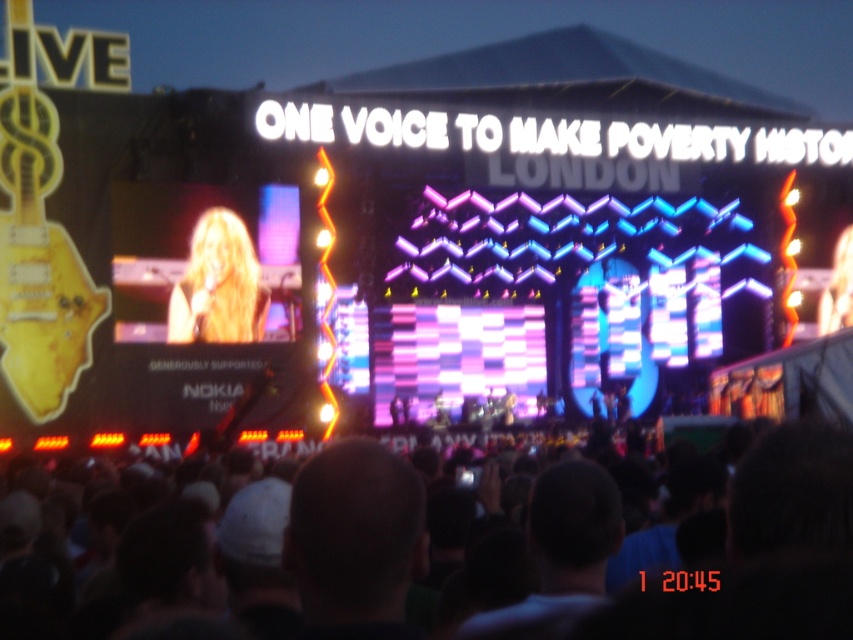
Is blonde hair at left further to the viewer compared to blonde hair at center?

No, blonde hair at left is closer to the viewer.

Which of these two, blonde hair at left or blonde hair at center, stands taller?

Standing taller between the two is blonde hair at left.

Where is `blonde hair at left`? Image resolution: width=853 pixels, height=640 pixels. blonde hair at left is located at coordinates (206, 262).

Which of these two, dark hair at center or blonde hair at left, stands shorter?

dark hair at center

Does dark hair at center have a greater height compared to blonde hair at left?

In fact, dark hair at center may be shorter than blonde hair at left.

At what (x,y) coordinates should I click in order to perform the action: click on dark hair at center. Please return your answer as a coordinate pair (x, y). This screenshot has width=853, height=640. Looking at the image, I should click on click(x=257, y=561).

Does dark hair at center have a smaller size compared to blonde hair at center?

Incorrect, dark hair at center is not smaller in size than blonde hair at center.

Is point (743, 576) farther from viewer compared to point (195, 321)?

No, (743, 576) is in front of (195, 321).

Based on the photo, who is more distant from viewer, (53,632) or (231,300)?

Positioned behind is point (231,300).

Locate an element on the screen. This screenshot has height=640, width=853. dark hair at center is located at coordinates (257, 561).